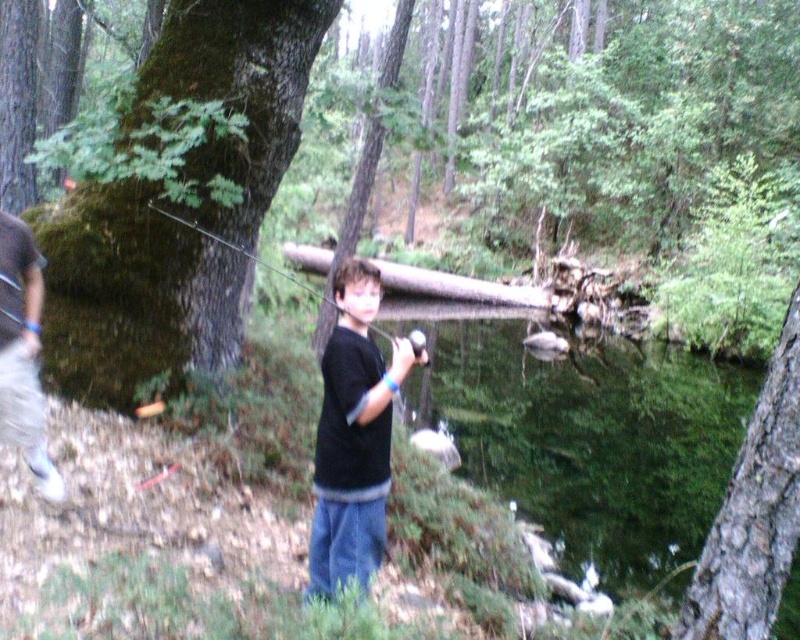
You are a photographer trying to capture the boy in the scene. You need to ensure that both the black matte shirt at center and the black plastic fishing pole at center are clearly visible in your shot. Based on their sizes, which object should you focus on first to ensure proper focus?

The black plastic fishing pole at center is taller than the black matte shirt at center, so focusing on the black plastic fishing pole at center first would ensure proper focus as it occupies a larger portion of the frame.

You are a photographer trying to capture a closeup of the boy fishing. You notice two points in the scene labeled as point (684, 464) and point (12, 289). Which point should you focus on to ensure the boy is in sharp focus?

You should focus on point (684, 464) because it is closer to the camera than point (12, 289), ensuring the boy is in sharp focus.